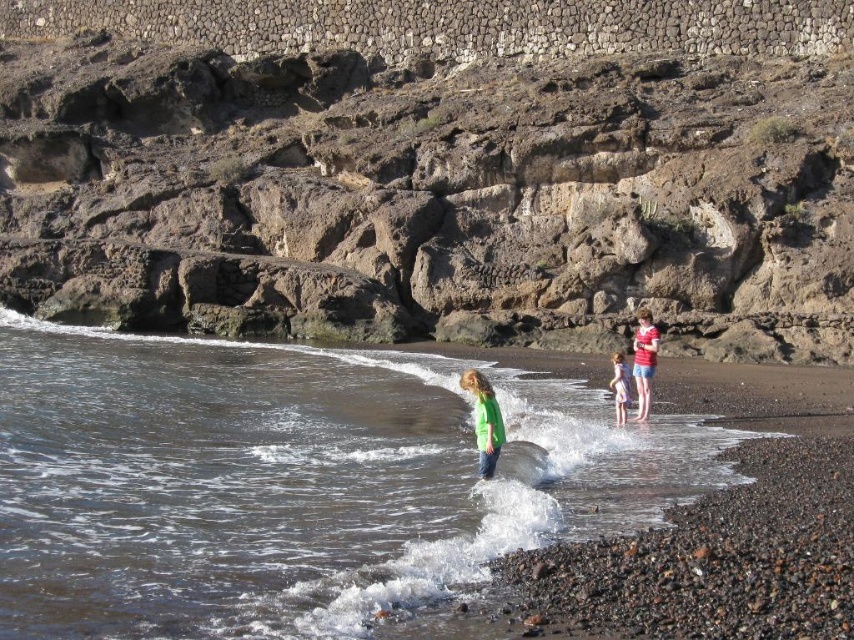
Which is in front, point (547, 33) or point (496, 403)?

Positioned in front is point (496, 403).

Does rustic stone wall at upper center appear over green matte shirt at center?

Correct, rustic stone wall at upper center is located above green matte shirt at center.

Which is behind, point (47, 17) or point (481, 388)?

The point (47, 17) is behind.

I want to click on rustic stone wall at upper center, so click(x=452, y=26).

Does brown rocky cliff at upper center come behind light pink fabric dress at lower right?

Yes.

Does brown rocky cliff at upper center appear on the left side of light pink fabric dress at lower right?

Correct, you'll find brown rocky cliff at upper center to the left of light pink fabric dress at lower right.

Which is in front, point (215, 67) or point (623, 400)?

Point (623, 400) is more forward.

In order to click on brown rocky cliff at upper center in this screenshot , I will do `click(431, 196)`.

Does brown rocky cliff at upper center have a greater width compared to matte red shirt at center?

Yes, brown rocky cliff at upper center is wider than matte red shirt at center.

Does brown rocky cliff at upper center have a larger size compared to matte red shirt at center?

Indeed, brown rocky cliff at upper center has a larger size compared to matte red shirt at center.

The image size is (854, 640). What do you see at coordinates (431, 196) in the screenshot?
I see `brown rocky cliff at upper center` at bounding box center [431, 196].

Locate an element on the screen. The width and height of the screenshot is (854, 640). brown rocky cliff at upper center is located at coordinates click(x=431, y=196).